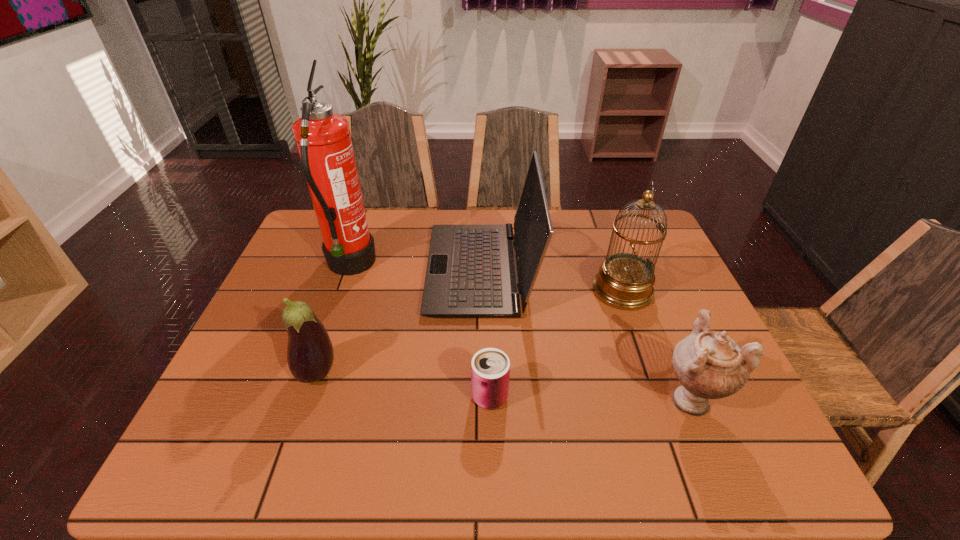
This screenshot has width=960, height=540. I want to click on free spot located 0.210m on the screen of the laptop computer, so click(x=355, y=269).

Where is `vacant area situated on the screen of the laptop computer`? Image resolution: width=960 pixels, height=540 pixels. vacant area situated on the screen of the laptop computer is located at coordinates (297, 269).

Where is `blank space located on the screen of the laptop computer`? The height and width of the screenshot is (540, 960). blank space located on the screen of the laptop computer is located at coordinates (355, 269).

The width and height of the screenshot is (960, 540). Find the location of `vacant position located 0.330m on the right of the eggplant`. vacant position located 0.330m on the right of the eggplant is located at coordinates (483, 372).

At what (x,y) coordinates should I click in order to perform the action: click on free space located 0.390m on the back of the urn. Please return your answer as a coordinate pair (x, y). The image size is (960, 540). Looking at the image, I should click on (634, 262).

Where is `vacant space situated on the left of the shortest object`? This screenshot has width=960, height=540. vacant space situated on the left of the shortest object is located at coordinates (448, 396).

At what (x,y) coordinates should I click in order to perform the action: click on fire extinguisher that is at the far edge. Please return your answer as a coordinate pair (x, y). Image resolution: width=960 pixels, height=540 pixels. Looking at the image, I should click on (323, 139).

This screenshot has width=960, height=540. What are the coordinates of `laptop computer located at the far edge` in the screenshot? It's located at (471, 273).

Identify the location of fire extinguisher at the left edge. (323, 139).

The height and width of the screenshot is (540, 960). Identify the location of eggplant present at the left edge. (310, 355).